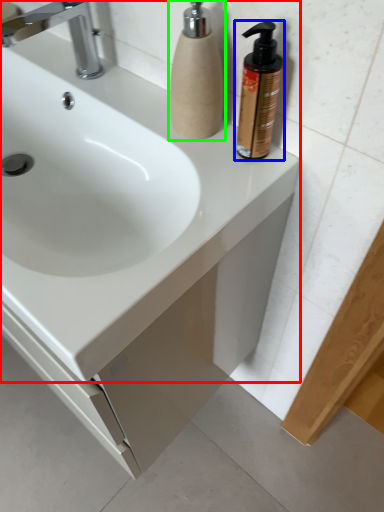
Question: Which object is the closest to the sink (highlighted by a red box)? Choose among these: soap dispenser (highlighted by a blue box) or soap dispenser (highlighted by a green box).

Choices:
 (A) soap dispenser
 (B) soap dispenser

Answer: (B)